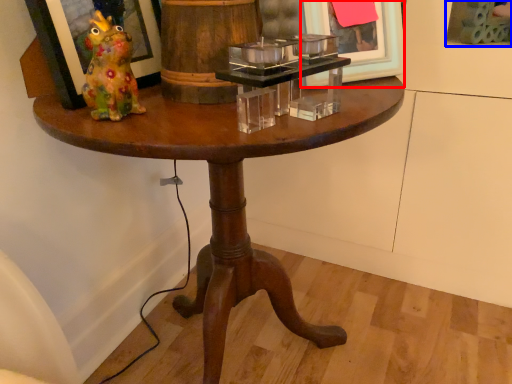
Question: Which point is further to the camera, picture frame (highlighted by a red box) or picture frame (highlighted by a blue box)?

Choices:
 (A) picture frame
 (B) picture frame

Answer: (B)